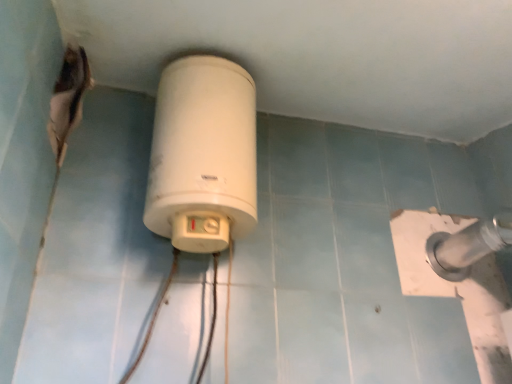
Describe the element at coordinates (203, 155) in the screenshot. I see `white plastic power plugs and sockets at center` at that location.

Find the location of a particular element. Image resolution: width=512 pixels, height=384 pixels. white plastic power plugs and sockets at center is located at coordinates pyautogui.click(x=203, y=155).

This screenshot has height=384, width=512. Find the location of `white plastic power plugs and sockets at center`. white plastic power plugs and sockets at center is located at coordinates (203, 155).